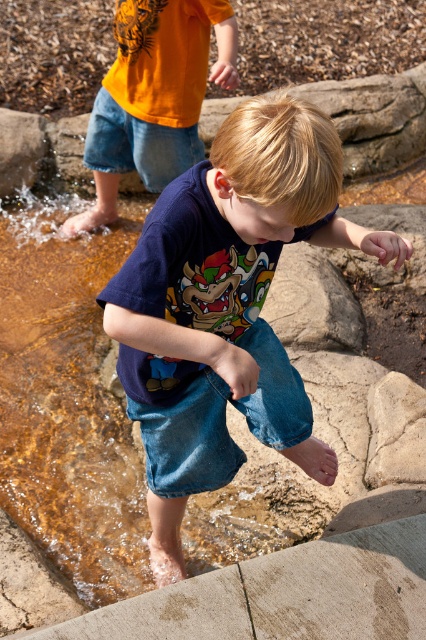
Question: Which point is farther to the camera?

Choices:
 (A) denim jeans at upper center
 (B) blue denim shorts at center
 (C) denim shorts at upper left
 (D) denim jeans at lower center

Answer: (A)

Question: Is blue denim shorts at center to the right of denim shorts at upper left from the viewer's perspective?

Choices:
 (A) yes
 (B) no

Answer: (A)

Question: Which of these objects is positioned farthest from the denim jeans at lower center?

Choices:
 (A) denim shorts at upper left
 (B) blue denim shorts at center

Answer: (A)

Question: Which point is farther to the camera?

Choices:
 (A) (227, 468)
 (B) (163, 188)

Answer: (B)

Question: Can you confirm if blue denim shorts at center is smaller than denim jeans at lower center?

Choices:
 (A) no
 (B) yes

Answer: (A)

Question: Does denim shorts at upper left have a lesser width compared to denim jeans at upper center?

Choices:
 (A) yes
 (B) no

Answer: (B)